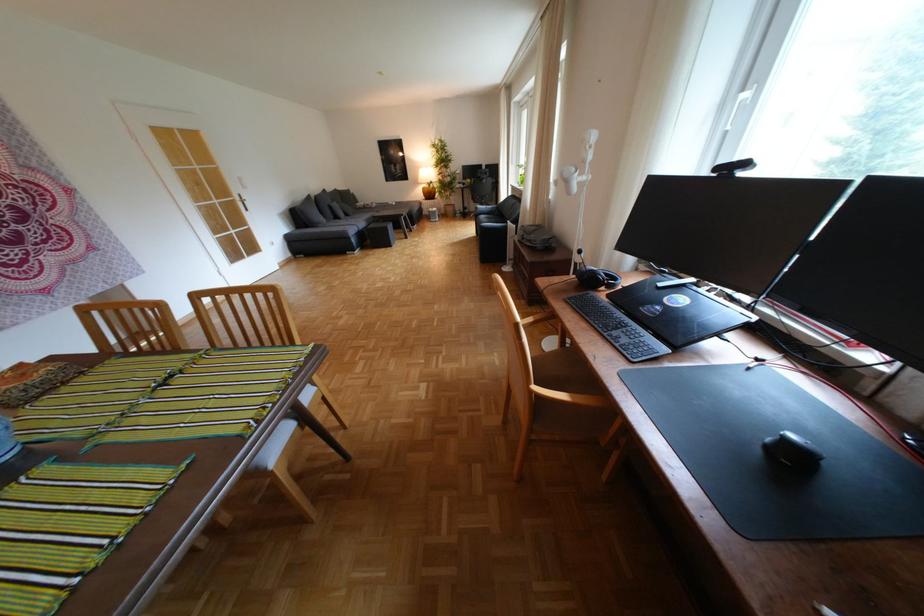
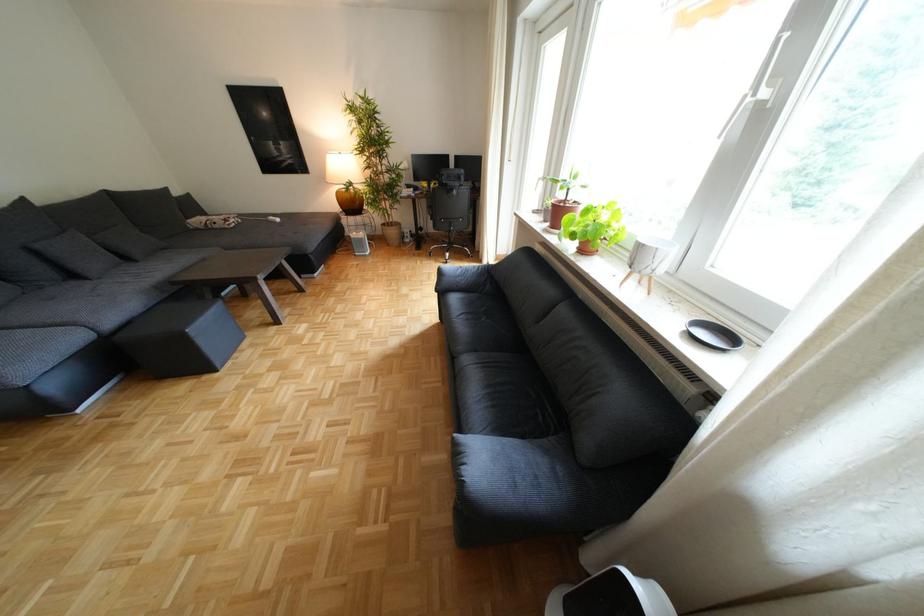
The point at (435, 188) is marked in the first image. Where is the corresponding point in the second image?

(351, 193)